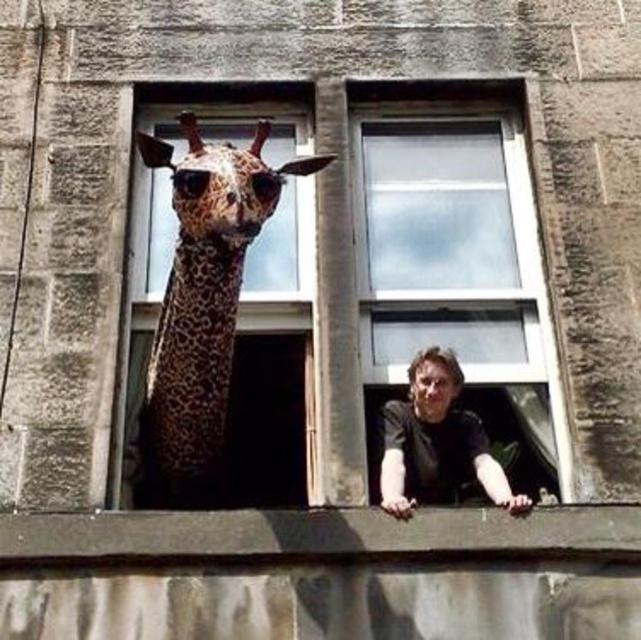
Based on the photo, can you confirm if dark brown leather jacket at center is wider than smooth brown hair at center?

Indeed, dark brown leather jacket at center has a greater width compared to smooth brown hair at center.

This screenshot has height=640, width=641. What do you see at coordinates (437, 442) in the screenshot?
I see `dark brown leather jacket at center` at bounding box center [437, 442].

Where is `dark brown leather jacket at center`? dark brown leather jacket at center is located at coordinates coord(437,442).

Between clear glass window at center and spotted brown spotted giraffe at left, which one is positioned lower?

spotted brown spotted giraffe at left

This screenshot has height=640, width=641. I want to click on clear glass window at center, so click(422, 276).

Consider the image. Who is lower down, clear glass window at center or smooth brown hair at center?

smooth brown hair at center

Can you confirm if clear glass window at center is smaller than smooth brown hair at center?

No, clear glass window at center is not smaller than smooth brown hair at center.

Between point (503, 387) and point (424, 380), which one is positioned in front?

Point (424, 380)

Where is `clear glass window at center`? Image resolution: width=641 pixels, height=640 pixels. clear glass window at center is located at coordinates (422, 276).